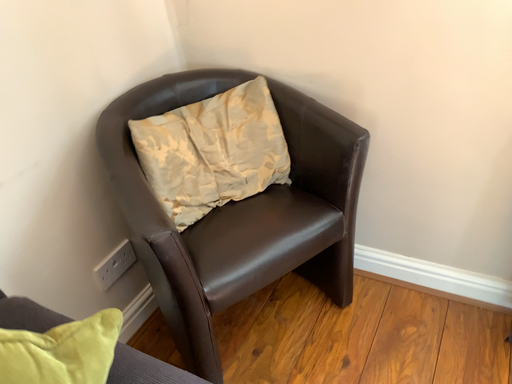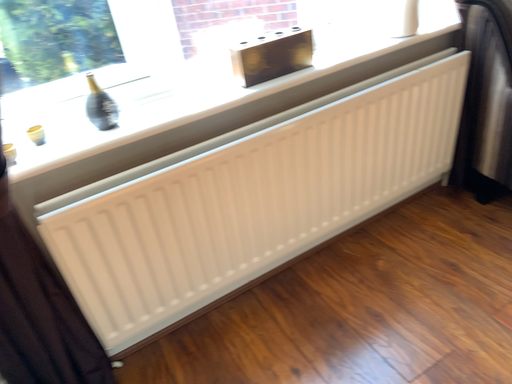
Question: How did the camera likely rotate when shooting the video?

Choices:
 (A) rotated downward
 (B) rotated upward

Answer: (B)